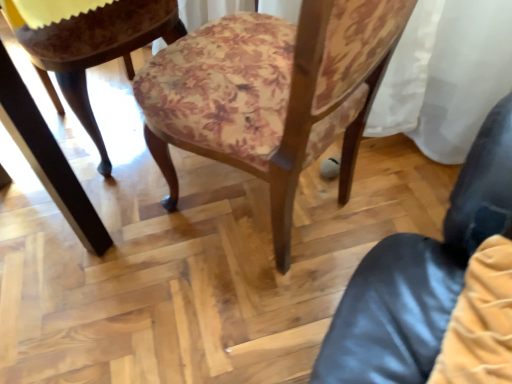
The image size is (512, 384). What do you see at coordinates (271, 94) in the screenshot?
I see `floral fabric chair at center` at bounding box center [271, 94].

The width and height of the screenshot is (512, 384). I want to click on floral fabric chair at center, so click(x=271, y=94).

This screenshot has width=512, height=384. Identify the location of floral fabric chair at center. (271, 94).